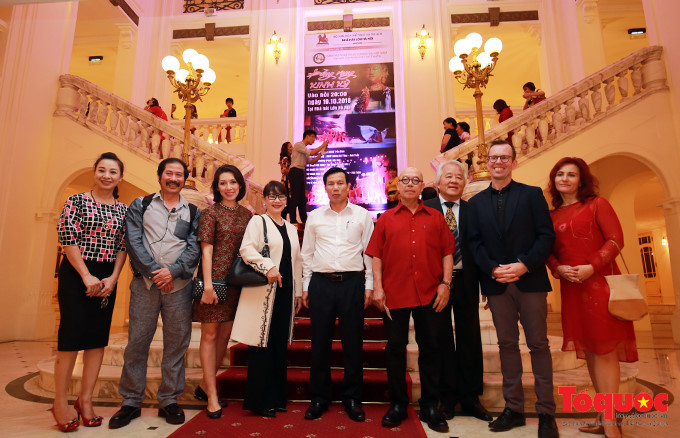
What are the coordinates of `carpet` in the screenshot? It's located at (306, 426).